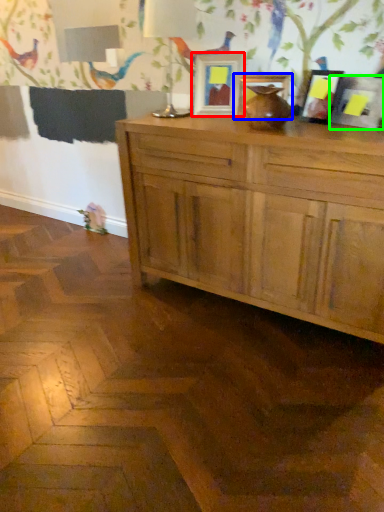
Question: Which object is the closest to the picture frame (highlighted by a red box)? Choose among these: picture frame (highlighted by a blue box) or picture frame (highlighted by a green box).

Choices:
 (A) picture frame
 (B) picture frame

Answer: (A)